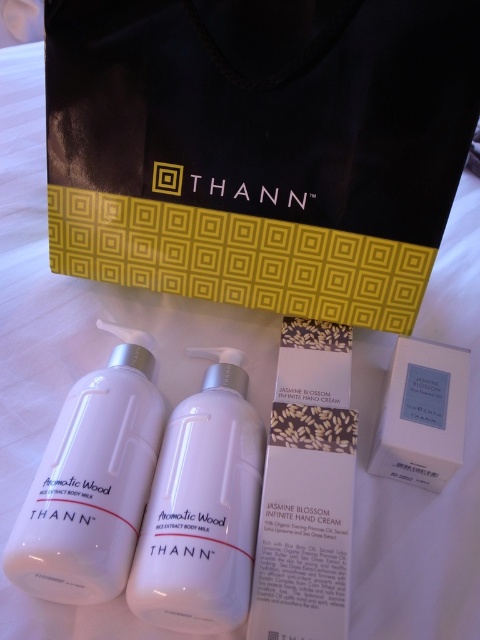
Question: In this image, where is black matte bag at upper center located relative to white matte bottle at center?

Choices:
 (A) right
 (B) left

Answer: (A)

Question: Observing the image, what is the correct spatial positioning of black matte bag at upper center in reference to white matte box at center?

Choices:
 (A) left
 (B) right

Answer: (A)

Question: Which is nearer to the white matte bottle at center?

Choices:
 (A) black matte bag at upper center
 (B) white matte box at center
 (C) white glossy bottle at center

Answer: (C)

Question: Which of these objects is positioned farthest from the white matte box at center?

Choices:
 (A) white glossy bottle at center
 (B) white matte bottle at center
 (C) black matte bag at upper center

Answer: (B)

Question: Is black matte bag at upper center to the left of white matte box at center from the viewer's perspective?

Choices:
 (A) no
 (B) yes

Answer: (B)

Question: Which point is farther to the camera?

Choices:
 (A) (251, 506)
 (B) (123, 333)

Answer: (B)